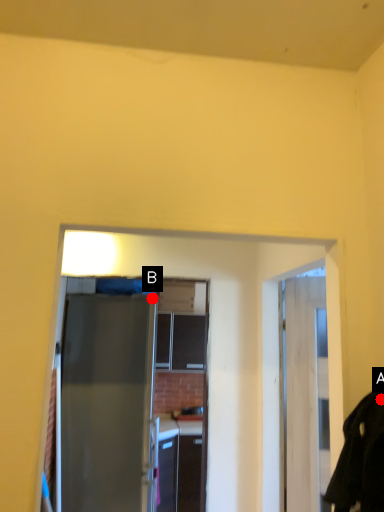
Question: Two points are circled on the image, labeled by A and B beside each circle. Which point appears farthest from the camera in this image?

Choices:
 (A) A is further
 (B) B is further

Answer: (B)